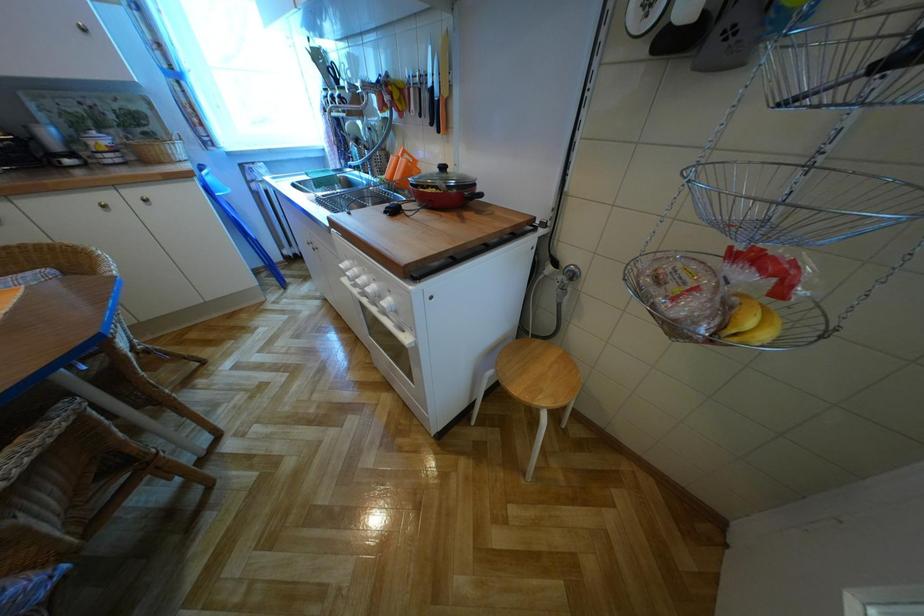
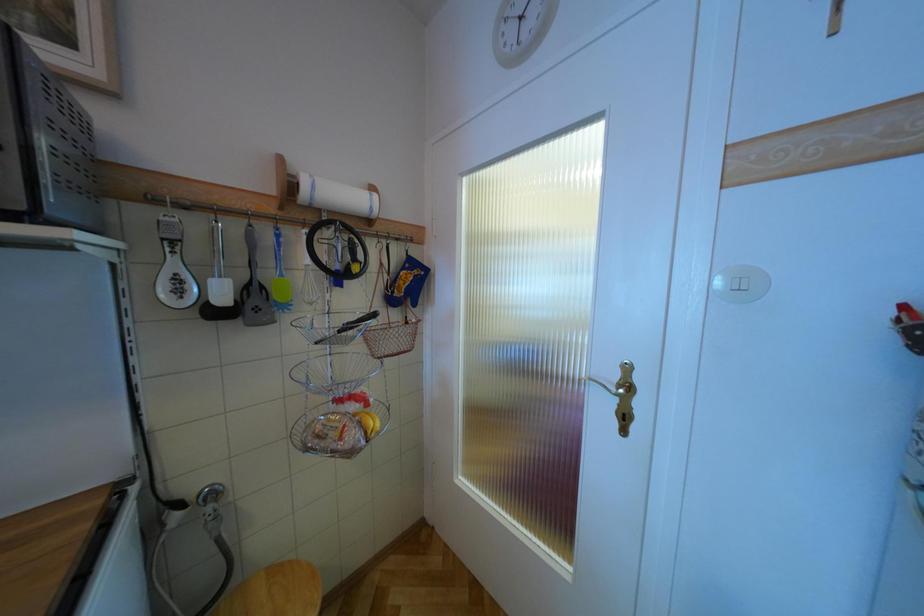
Question: The camera is either moving clockwise (left) or counter-clockwise (right) around the object. The first image is from the beginning of the video and the second image is from the end. Is the camera moving left or right when shooting the video?

Choices:
 (A) Left
 (B) Right

Answer: (A)